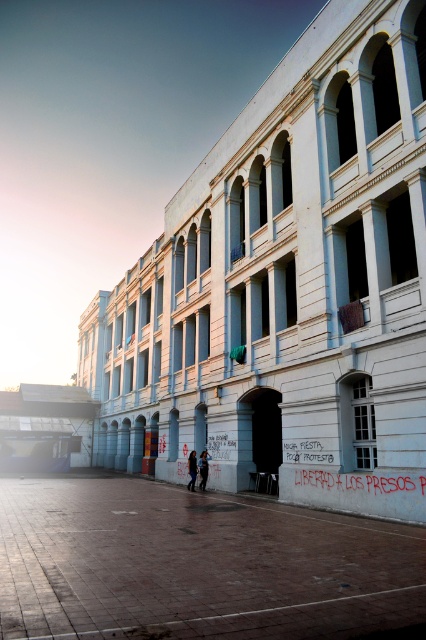
You are standing in front of the building and see both the blue denim jacket at center and the dark blue jeans at center. Which one is nearer to you?

The blue denim jacket at center is closer to the viewer than the dark blue jeans at center, so the blue denim jacket at center is nearer to you.

You are standing in front of the classical building and want to place a pair of dark blue jeans at center on the smooth concrete plaza at center. Can the plaza accommodate the jeans?

The smooth concrete plaza at center has a larger size compared to dark blue jeans at center, so yes, the plaza can accommodate the jeans since it is bigger.